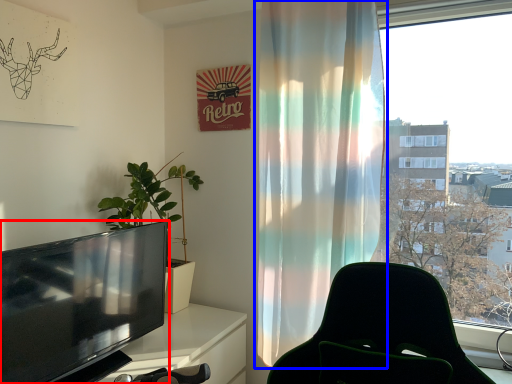
Question: Which of the following is the farthest to the observer, television (highlighted by a red box) or curtain (highlighted by a blue box)?

Choices:
 (A) television
 (B) curtain

Answer: (B)